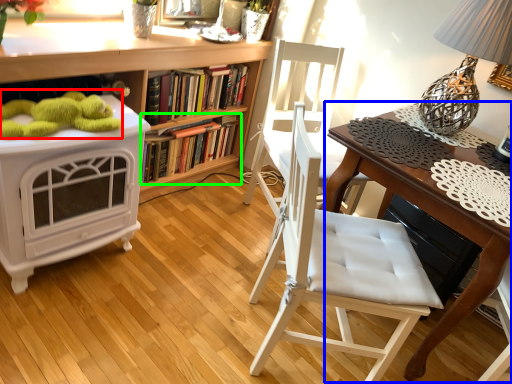
Question: Which is nearer to the toy (highlighted by a red box)? table (highlighted by a blue box) or book (highlighted by a green box).

Choices:
 (A) table
 (B) book

Answer: (B)